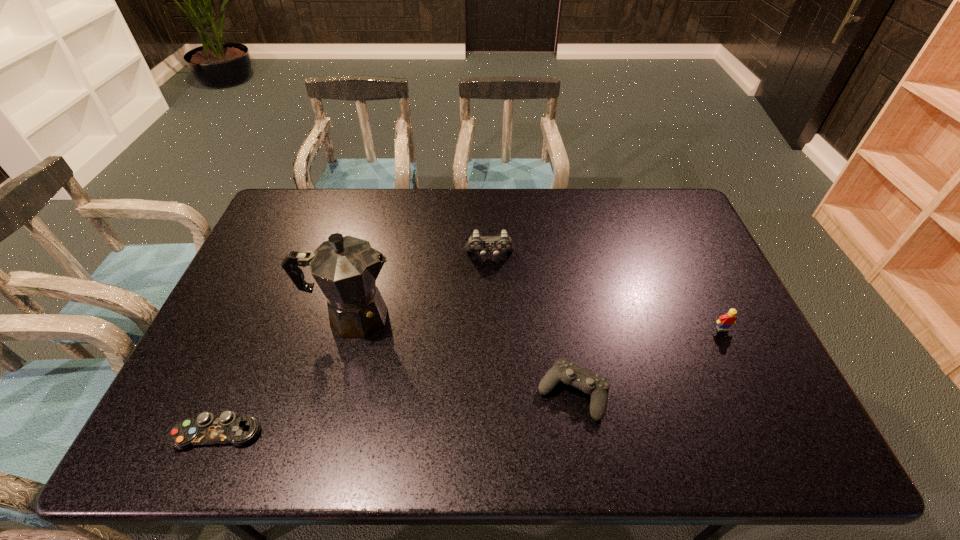
The width and height of the screenshot is (960, 540). What are the coordinates of `vacant space at the left edge of the desktop` in the screenshot? It's located at (266, 276).

The width and height of the screenshot is (960, 540). In the image, there is a desktop. Find the location of `vacant area at the right edge`. vacant area at the right edge is located at coordinates (697, 347).

Identify the location of free spot at the far left corner of the desktop. (296, 188).

At what (x,y) coordinates should I click in order to perform the action: click on vacant position at the far right corner of the desktop. Please return your answer as a coordinate pair (x, y). The image size is (960, 540). Looking at the image, I should click on (654, 203).

This screenshot has height=540, width=960. I want to click on free area in between the third object from left to right and the tallest object, so click(x=421, y=286).

Locate an element on the screen. Image resolution: width=960 pixels, height=540 pixels. vacant area that lies between the second tallest control and the second control from right to left is located at coordinates (531, 325).

You are a GUI agent. You are given a task and a screenshot of the screen. Output one action in this format:
    pyautogui.click(x=<x>, y=<y>)
    Task: Click on the free point between the second tallest control and the Lego
    
    Given the screenshot: What is the action you would take?
    [x=648, y=361]

What are the coordinates of `vacant point located between the leftmost object and the tallest control` in the screenshot? It's located at (354, 345).

Identify the location of free spot between the rightmost object and the second control from right to left. (606, 293).

I want to click on empty space that is in between the shortest object and the tallest object, so click(285, 375).